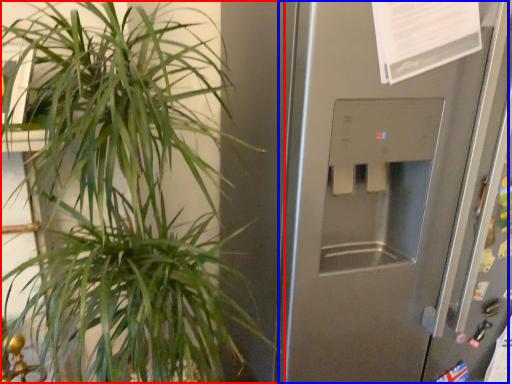
Question: Among these objects, which one is nearest to the camera, houseplant (highlighted by a red box) or screen door (highlighted by a blue box)?

Choices:
 (A) houseplant
 (B) screen door

Answer: (A)